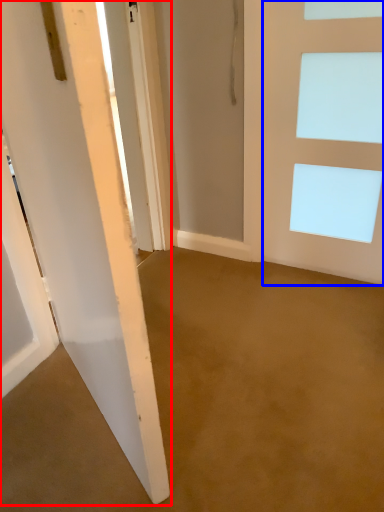
Question: Which object appears closest to the camera in this image, door (highlighted by a red box) or door (highlighted by a blue box)?

Choices:
 (A) door
 (B) door

Answer: (A)